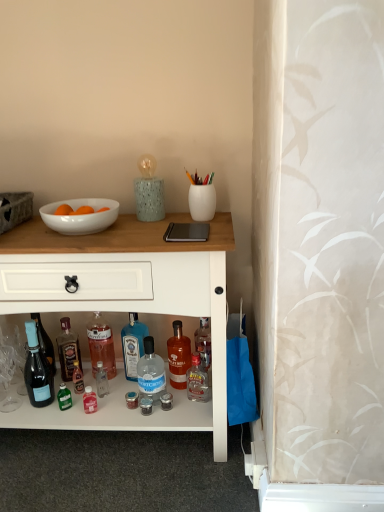
Where is `free location to the right of white glossy bowl at upper left`? free location to the right of white glossy bowl at upper left is located at coordinates (143, 228).